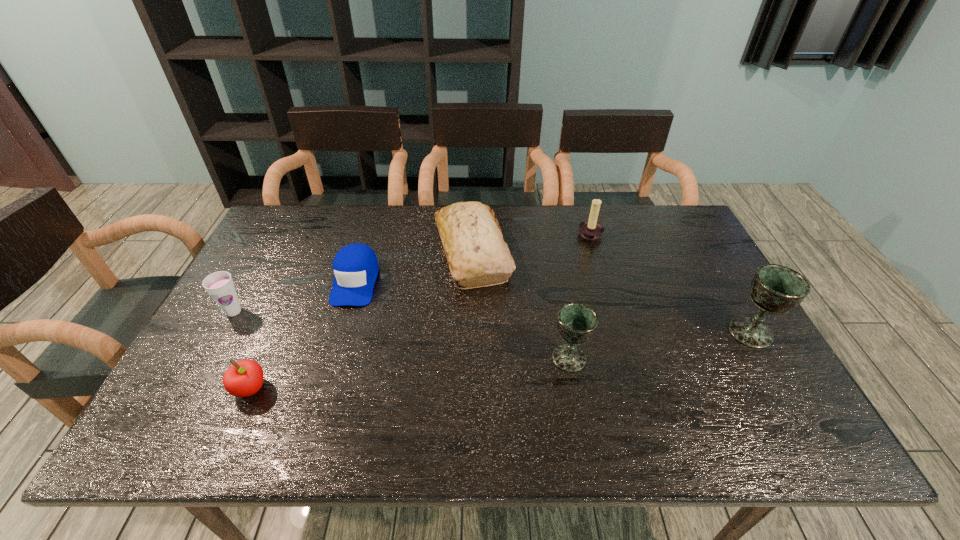
Locate an element on the screen. Image resolution: width=960 pixels, height=540 pixels. vacant area between the fifth object from right to left and the sixth object from right to left is located at coordinates (303, 334).

Identify the location of blank region between the leftmost object and the second object from left to right. (242, 350).

Choose which object is the sixth nearest neighbor to the rightmost object. Please provide its 2D coordinates. Your answer should be formatted as a tuple, i.e. [(x, y)], where the tuple contains the x and y coordinates of a point satisfying the conditions above.

[(220, 286)]

Select which object appears as the sixth closest to the fifth object from left to right. Please provide its 2D coordinates. Your answer should be formatted as a tuple, i.e. [(x, y)], where the tuple contains the x and y coordinates of a point satisfying the conditions above.

[(220, 286)]

You are a GUI agent. You are given a task and a screenshot of the screen. Output one action in this format:
    pyautogui.click(x=<x>, y=<y>)
    Task: Click on the vacant region that satisfies the following two spatial constraints: 1. on the wick of the candle holder; 2. on the front-facing side of the baseball cap
    The image size is (960, 540).
    Given the screenshot: What is the action you would take?
    pyautogui.click(x=604, y=281)